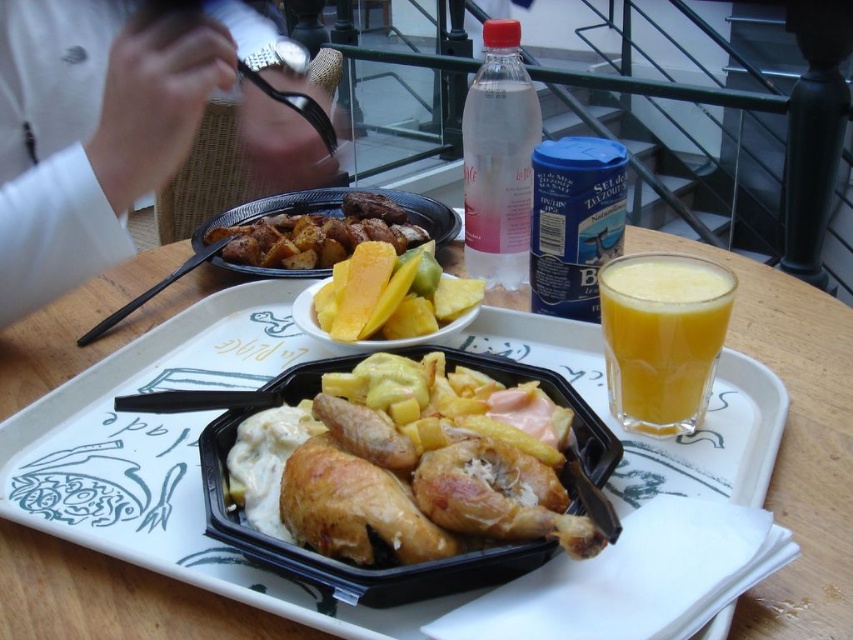
Who is positioned more to the left, black plastic tray at center or yellow matte pineapple at center?

yellow matte pineapple at center is more to the left.

Which of these two, black plastic tray at center or yellow matte pineapple at center, stands taller?

With more height is black plastic tray at center.

Does point (184, 376) come behind point (358, 200)?

No, (184, 376) is in front of (358, 200).

At what (x,y) coordinates should I click in order to perform the action: click on black plastic tray at center. Please return your answer as a coordinate pair (x, y). This screenshot has width=853, height=640. Looking at the image, I should click on (172, 460).

Between point (509, 163) and point (306, 221), which one is positioned behind?

The point (306, 221) is more distant.

Measure the distance between clear plastic bottle at upper center and camera.

clear plastic bottle at upper center is 43.13 centimeters away from camera.

Which is behind, point (509, 145) or point (300, 268)?

The point (300, 268) is behind.

The width and height of the screenshot is (853, 640). Find the location of `clear plastic bottle at upper center`. clear plastic bottle at upper center is located at coordinates (498, 160).

Which is behind, point (448, 554) or point (320, 253)?

The point (320, 253) is behind.

Is golden crispy chicken at center positioned before yellow matte pineapple at center?

That is True.

At what (x,y) coordinates should I click in order to perform the action: click on golden crispy chicken at center. Please return your answer as a coordinate pair (x, y). This screenshot has width=853, height=640. Looking at the image, I should click on 419,490.